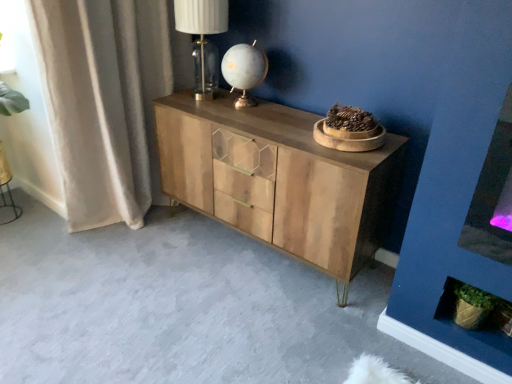
Question: Is beige fabric curtain at left facing away from translucent glass table lamp at upper center, which appears as the first table lamp when viewed from the left?

Choices:
 (A) yes
 (B) no

Answer: (A)

Question: From a real-world perspective, is beige fabric curtain at left physically below translucent glass table lamp at upper center, arranged as the second table lamp when viewed from the right?

Choices:
 (A) yes
 (B) no

Answer: (A)

Question: Is beige fabric curtain at left with translucent glass table lamp at upper center, which appears as the first table lamp when viewed from the left?

Choices:
 (A) no
 (B) yes

Answer: (A)

Question: From a real-world perspective, is beige fabric curtain at left on top of translucent glass table lamp at upper center, arranged as the second table lamp when viewed from the right?

Choices:
 (A) yes
 (B) no

Answer: (B)

Question: Is beige fabric curtain at left smaller than translucent glass table lamp at upper center, arranged as the second table lamp when viewed from the right?

Choices:
 (A) no
 (B) yes

Answer: (A)

Question: From the image's perspective, is translucent glass table lamp at upper center, which appears as the first table lamp when viewed from the left, above or below beige fabric curtain at left?

Choices:
 (A) below
 (B) above

Answer: (B)

Question: From a real-world perspective, relative to beige fabric curtain at left, is translucent glass table lamp at upper center, which appears as the first table lamp when viewed from the left, vertically above or below?

Choices:
 (A) below
 (B) above

Answer: (B)

Question: Is translucent glass table lamp at upper center, which appears as the first table lamp when viewed from the left, in front of or behind beige fabric curtain at left in the image?

Choices:
 (A) behind
 (B) front

Answer: (A)

Question: In terms of height, does translucent glass table lamp at upper center, arranged as the second table lamp when viewed from the right, look taller or shorter compared to beige fabric curtain at left?

Choices:
 (A) short
 (B) tall

Answer: (A)

Question: In terms of width, does beige fabric curtain at left look wider or thinner when compared to natural wood cabinet at center?

Choices:
 (A) wide
 (B) thin

Answer: (B)

Question: Choose the correct answer: Is beige fabric curtain at left inside natural wood cabinet at center or outside it?

Choices:
 (A) inside
 (B) outside

Answer: (B)

Question: Considering the positions of beige fabric curtain at left and natural wood cabinet at center in the image, is beige fabric curtain at left taller or shorter than natural wood cabinet at center?

Choices:
 (A) tall
 (B) short

Answer: (A)

Question: From the image's perspective, is beige fabric curtain at left located above or below natural wood cabinet at center?

Choices:
 (A) above
 (B) below

Answer: (A)

Question: Considering the positions of point 58,107 and point 202,1, is point 58,107 closer or farther from the camera than point 202,1?

Choices:
 (A) farther
 (B) closer

Answer: (A)

Question: Choose the correct answer: Is beige fabric curtain at left inside translucent glass table lamp at upper center, which appears as the first table lamp when viewed from the left, or outside it?

Choices:
 (A) inside
 (B) outside

Answer: (B)